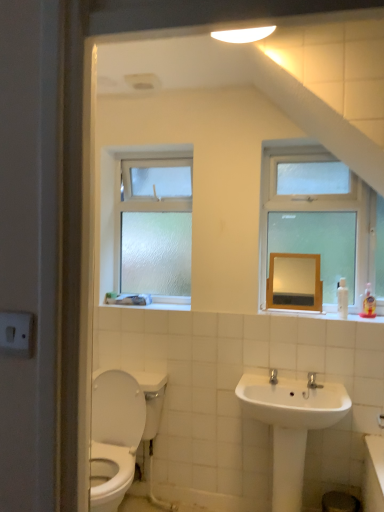
Question: From the image's perspective, is white glossy sink at lower center above or below matte wooden mirror at upper center?

Choices:
 (A) above
 (B) below

Answer: (B)

Question: From their relative heights in the image, would you say white glossy sink at lower center is taller or shorter than matte wooden mirror at upper center?

Choices:
 (A) short
 (B) tall

Answer: (B)

Question: Based on their relative distances, which object is farther from the frosted glass window at upper left, the 1th window positioned from the left?

Choices:
 (A) clear glass window at upper right, which is counted as the second window, starting from the back
 (B) matte wooden mirror at upper center
 (C) white glossy sink at lower center

Answer: (C)

Question: Which object is the closest to the clear glass window at upper right, the 2th window in the left-to-right sequence?

Choices:
 (A) frosted glass window at upper left, the 1th window positioned from the left
 (B) white glossy sink at lower center
 (C) matte wooden mirror at upper center

Answer: (C)